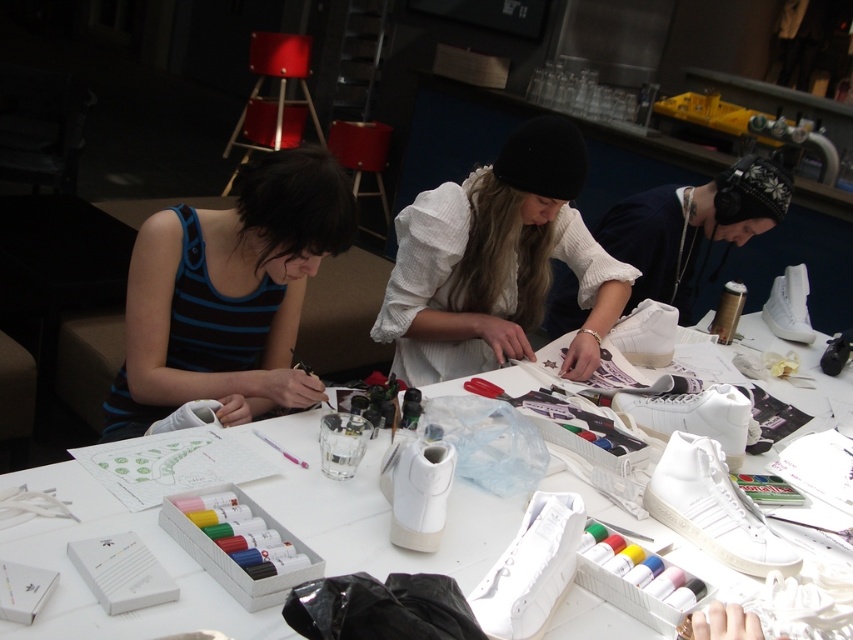
Who is higher up, white cotton shirt at center or white matte sneaker at center?

white matte sneaker at center is higher up.

Is white cotton shirt at center closer to the viewer compared to white matte sneaker at center?

Yes, it is.

This screenshot has width=853, height=640. Describe the element at coordinates (497, 262) in the screenshot. I see `white cotton shirt at center` at that location.

This screenshot has height=640, width=853. Find the location of `white cotton shirt at center`. white cotton shirt at center is located at coordinates (497, 262).

Between blue striped tank top at left and white cotton shirt at center, which one is positioned higher?

white cotton shirt at center is above.

Who is more forward, [126,376] or [425,326]?

Point [126,376] is in front.

Where is `blue striped tank top at left`? The height and width of the screenshot is (640, 853). blue striped tank top at left is located at coordinates (228, 296).

Which is above, white matte sneakers at center or white cotton shirt at center?

white cotton shirt at center is higher up.

Is white matte sneakers at center to the right of white cotton shirt at center from the viewer's perspective?

Incorrect, white matte sneakers at center is not on the right side of white cotton shirt at center.

The image size is (853, 640). I want to click on white matte sneakers at center, so click(x=370, y=509).